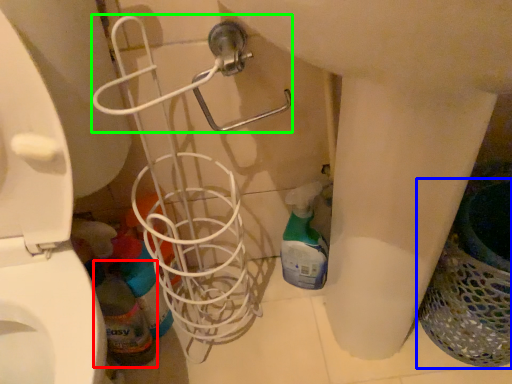
Question: Which object is the closest to the bottle (highlighted by a red box)? Choose among these: laundry basket (highlighted by a blue box) or shower (highlighted by a green box).

Choices:
 (A) laundry basket
 (B) shower

Answer: (B)